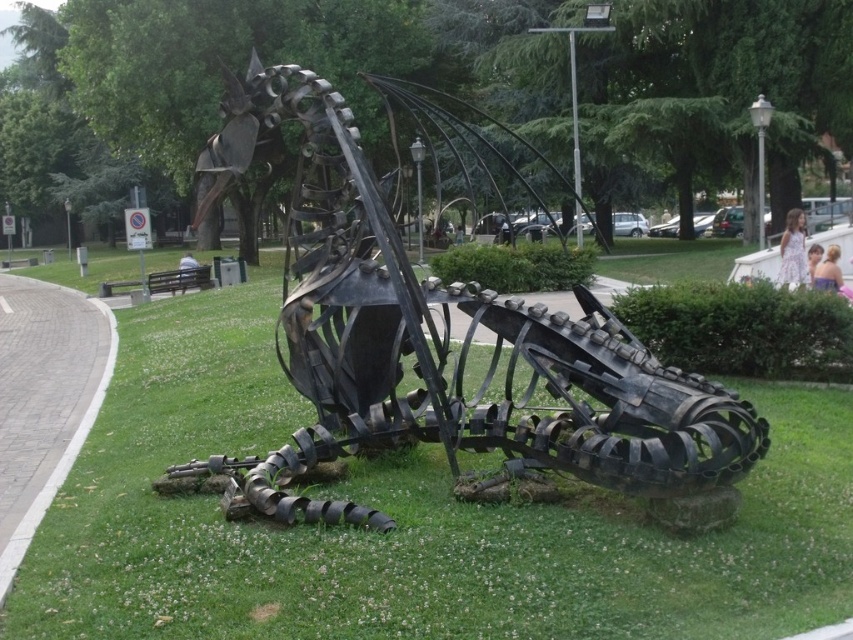
Question: From the image, what is the correct spatial relationship of green grass at center in relation to metallic sculpture at center?

Choices:
 (A) below
 (B) above

Answer: (A)

Question: Does green grass at center come in front of metallic sculpture at center?

Choices:
 (A) yes
 (B) no

Answer: (A)

Question: Is green grass at center closer to camera compared to metallic sculpture at center?

Choices:
 (A) no
 (B) yes

Answer: (B)

Question: Which of the following is the farthest from the observer?

Choices:
 (A) green grass at center
 (B) metallic sculpture at center

Answer: (B)

Question: Which point is closer to the camera?

Choices:
 (A) (144, 557)
 (B) (712, 412)

Answer: (A)